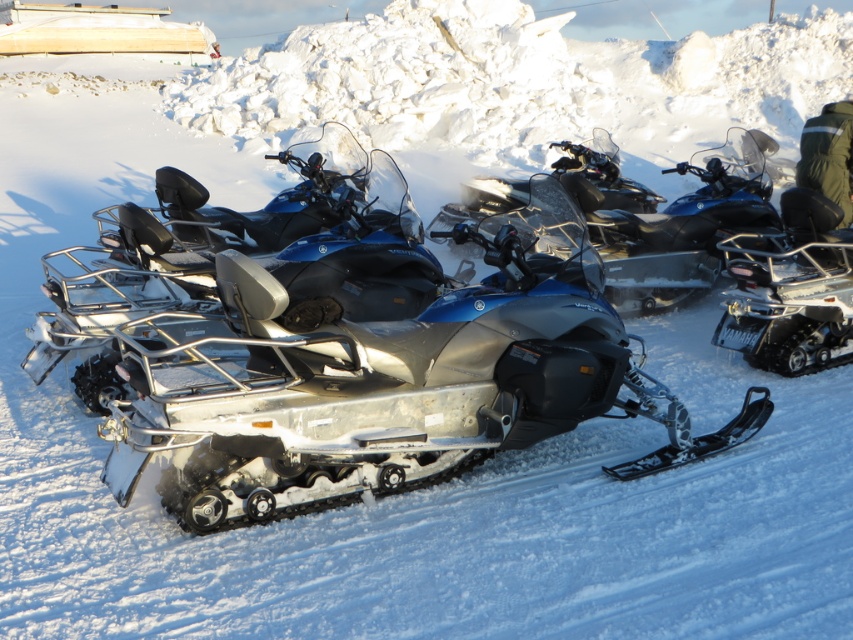
You are standing in the snowy area and see the silver metallic snowmobile at right and the green fabric jacket at upper right. Which object is positioned more to the right side of the scene?

The green fabric jacket at upper right is positioned more to the right side of the scene because the silver metallic snowmobile at right is to the left of it.

You are standing at the front of the glossy metallic snowmobile at center and want to see the silver metallic snowmobile at right. Which direction should you turn to face it?

The silver metallic snowmobile at right is behind the glossy metallic snowmobile at center, so you should turn around to face it.

You are a photographer setting up a shot of the glossy metallic snowmobile at center and the green fabric jacket at upper right. You need to ensure both subjects are in focus. Which subject should you focus on first to account for their size difference?

The glossy metallic snowmobile at center is taller than the green fabric jacket at upper right, so you should focus on the glossy metallic snowmobile at center first as it is larger and requires more attention to detail.